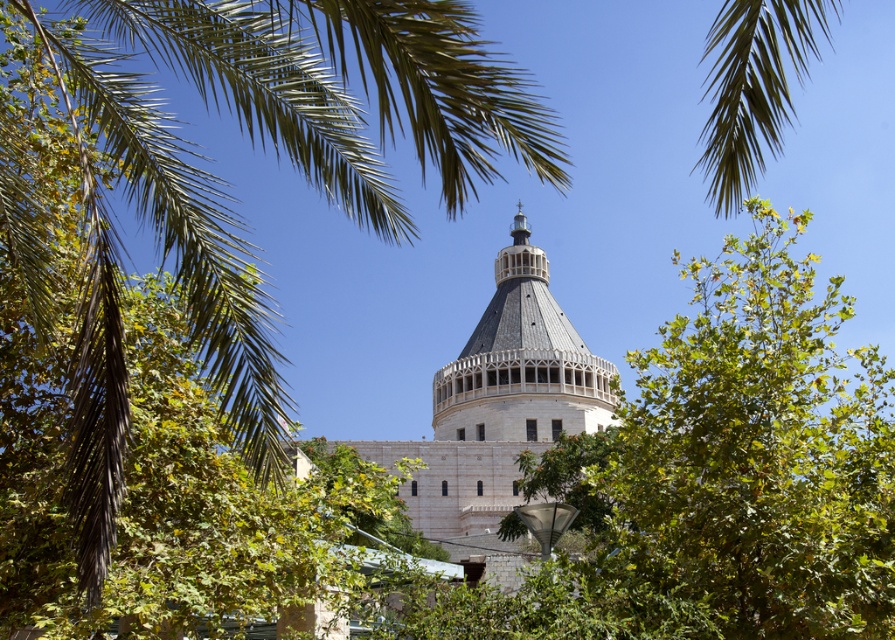
Who is more forward, (470,397) or (470,339)?

Positioned in front is point (470,397).

Identify the location of stone dome at center. (500, 403).

Based on the photo, between green leafy palm at upper left and stone textured dome at center, which one appears on the left side from the viewer's perspective?

green leafy palm at upper left

Locate an element on the screen. The image size is (895, 640). green leafy palm at upper left is located at coordinates (220, 180).

At what (x,y) coordinates should I click in order to perform the action: click on green leafy palm at upper left. Please return your answer as a coordinate pair (x, y). This screenshot has width=895, height=640. Looking at the image, I should click on (220, 180).

Can you confirm if green leafy palm at upper left is positioned to the right of stone dome at center?

Incorrect, green leafy palm at upper left is not on the right side of stone dome at center.

Between green leafy palm at upper left and stone dome at center, which one is positioned lower?

Positioned lower is stone dome at center.

Where is `green leafy palm at upper left`? Image resolution: width=895 pixels, height=640 pixels. green leafy palm at upper left is located at coordinates (220, 180).

At what (x,y) coordinates should I click in order to perform the action: click on green leafy palm at upper left. Please return your answer as a coordinate pair (x, y). Looking at the image, I should click on (220, 180).